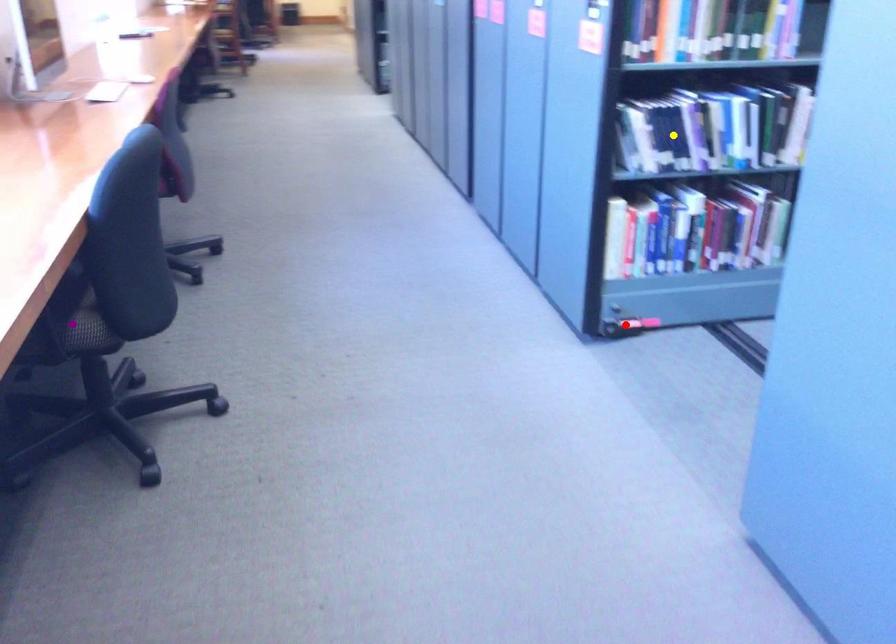
Order these from nearest to farthest:
- yellow point
- red point
- purple point

purple point
yellow point
red point